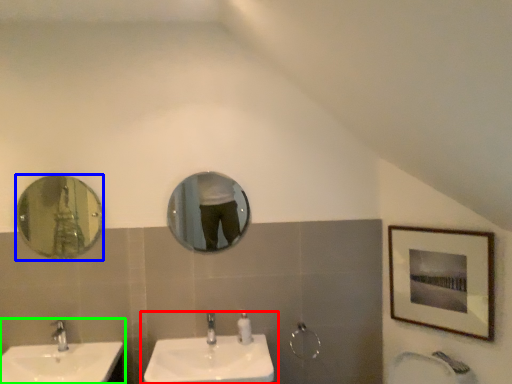
Question: Based on their relative distances, which object is farther from sink (highlighted by a red box)? Choose from mirror (highlighted by a blue box) and sink (highlighted by a green box).

Choices:
 (A) mirror
 (B) sink

Answer: (A)